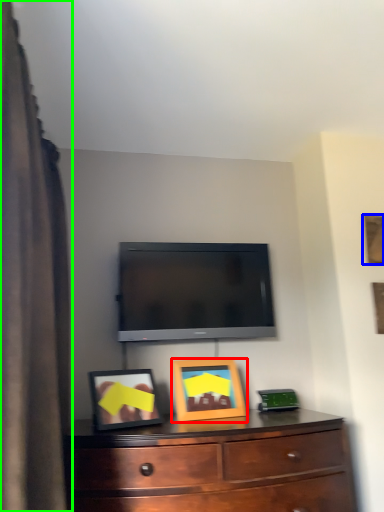
Question: Which object is the farthest from picture frame (highlighted by a red box)? Choose among these: picture frame (highlighted by a blue box) or curtain (highlighted by a green box).

Choices:
 (A) picture frame
 (B) curtain

Answer: (A)